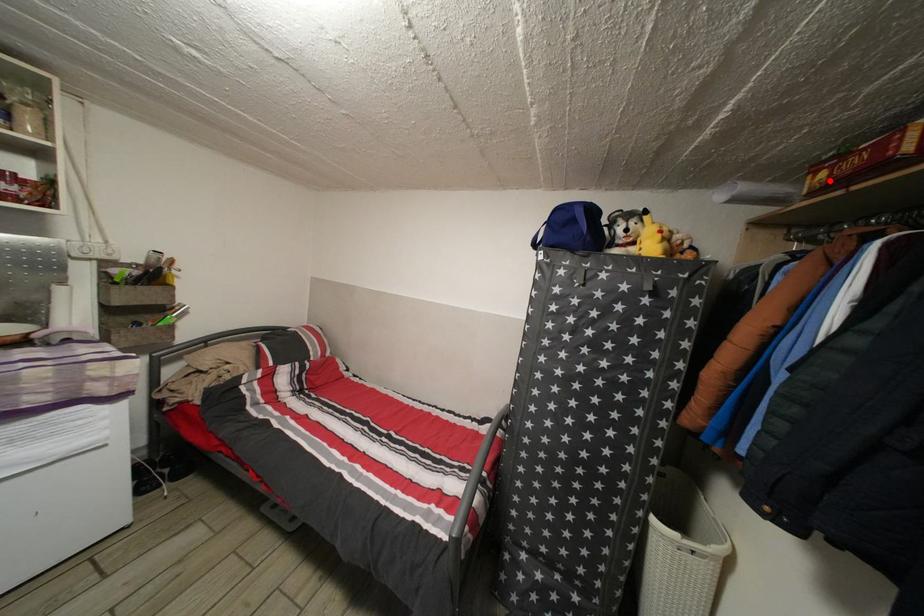
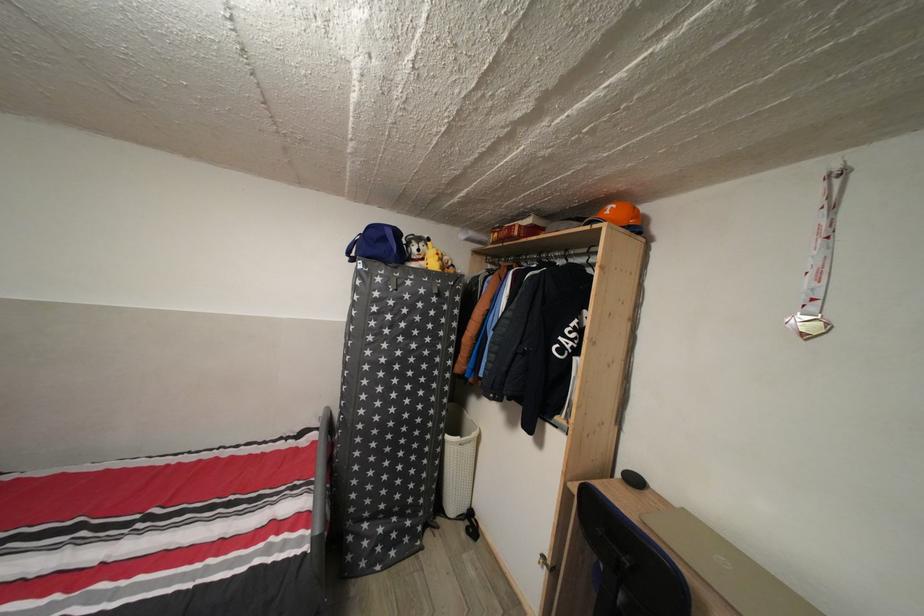
Locate, in the second image, the point that corresponds to the highlighted location in the first image.

(503, 241)